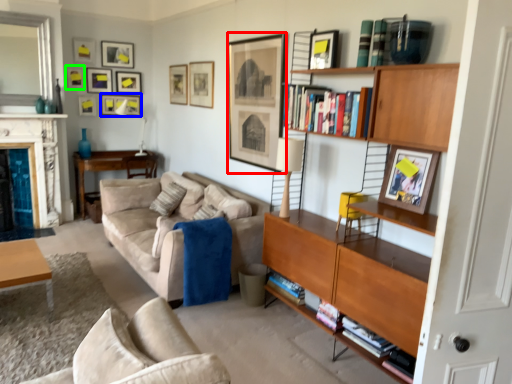
Question: Which object is positioned closest to picture frame (highlighted by a red box)? Select from picture frame (highlighted by a blue box) and picture frame (highlighted by a green box).

Choices:
 (A) picture frame
 (B) picture frame

Answer: (A)